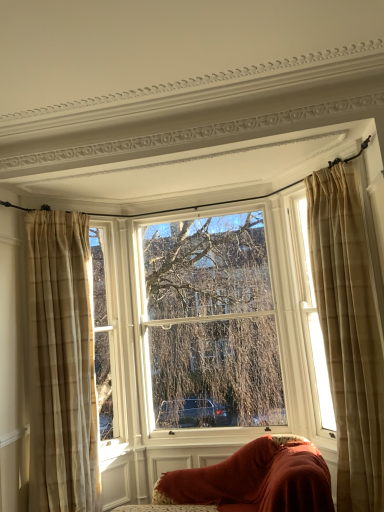
Question: From a real-world perspective, does velvet red sofa at lower center stand above beige plaid curtain at right, which is counted as the first curtain, starting from the right?

Choices:
 (A) yes
 (B) no

Answer: (B)

Question: Does velvet red sofa at lower center have a larger size compared to beige plaid curtain at right, which ranks as the second curtain in left-to-right order?

Choices:
 (A) yes
 (B) no

Answer: (B)

Question: Considering the relative positions of velvet red sofa at lower center and beige plaid curtain at right, which ranks as the second curtain in left-to-right order, in the image provided, is velvet red sofa at lower center to the left of beige plaid curtain at right, which ranks as the second curtain in left-to-right order, from the viewer's perspective?

Choices:
 (A) yes
 (B) no

Answer: (A)

Question: Can you confirm if velvet red sofa at lower center is taller than beige plaid curtain at right, which ranks as the second curtain in left-to-right order?

Choices:
 (A) no
 (B) yes

Answer: (A)

Question: Would you consider velvet red sofa at lower center to be distant from beige plaid curtain at right, which is counted as the first curtain, starting from the right?

Choices:
 (A) no
 (B) yes

Answer: (A)

Question: Is velvet red sofa at lower center positioned beyond the bounds of beige plaid curtain at right, which ranks as the second curtain in left-to-right order?

Choices:
 (A) no
 (B) yes

Answer: (B)

Question: Can you confirm if velvet red sofa at lower center is smaller than clear glass window at center, marked as the 1th window in a left-to-right arrangement?

Choices:
 (A) yes
 (B) no

Answer: (A)

Question: Does velvet red sofa at lower center have a larger size compared to clear glass window at center, placed as the 2th window when sorted from right to left?

Choices:
 (A) yes
 (B) no

Answer: (B)

Question: Can you see velvet red sofa at lower center touching clear glass window at center, marked as the 1th window in a left-to-right arrangement?

Choices:
 (A) no
 (B) yes

Answer: (A)

Question: Can you confirm if velvet red sofa at lower center is thinner than clear glass window at center, placed as the 2th window when sorted from right to left?

Choices:
 (A) yes
 (B) no

Answer: (B)

Question: Can you confirm if velvet red sofa at lower center is positioned to the left of clear glass window at center, placed as the 2th window when sorted from right to left?

Choices:
 (A) yes
 (B) no

Answer: (B)

Question: From a real-world perspective, is velvet red sofa at lower center under clear glass window at center, placed as the 2th window when sorted from right to left?

Choices:
 (A) no
 (B) yes

Answer: (B)

Question: Considering the relative sizes of clear glass window at center, marked as the 1th window in a left-to-right arrangement, and sheer beige curtains at right, which is the 2th window from left to right, in the image provided, is clear glass window at center, marked as the 1th window in a left-to-right arrangement, thinner than sheer beige curtains at right, which is the 2th window from left to right,?

Choices:
 (A) yes
 (B) no

Answer: (B)